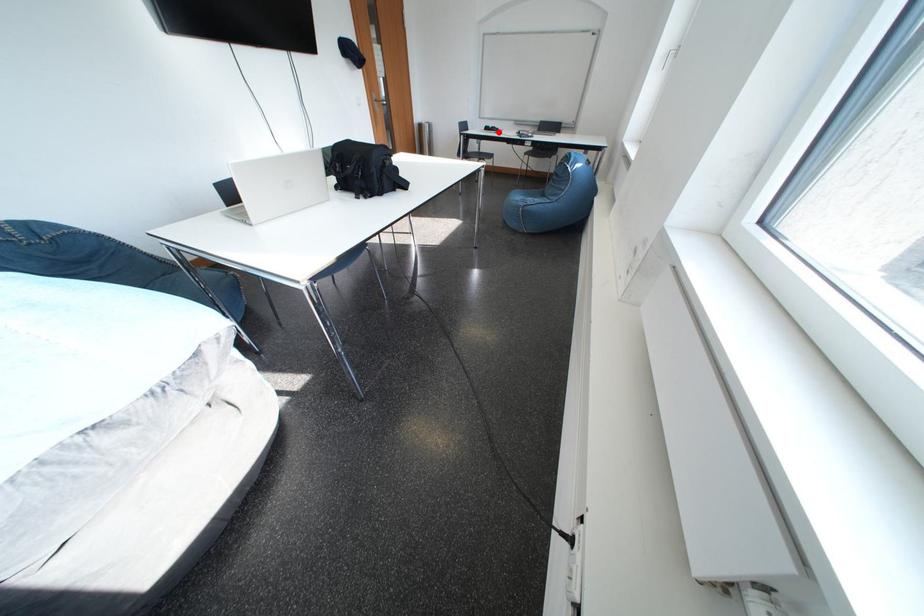
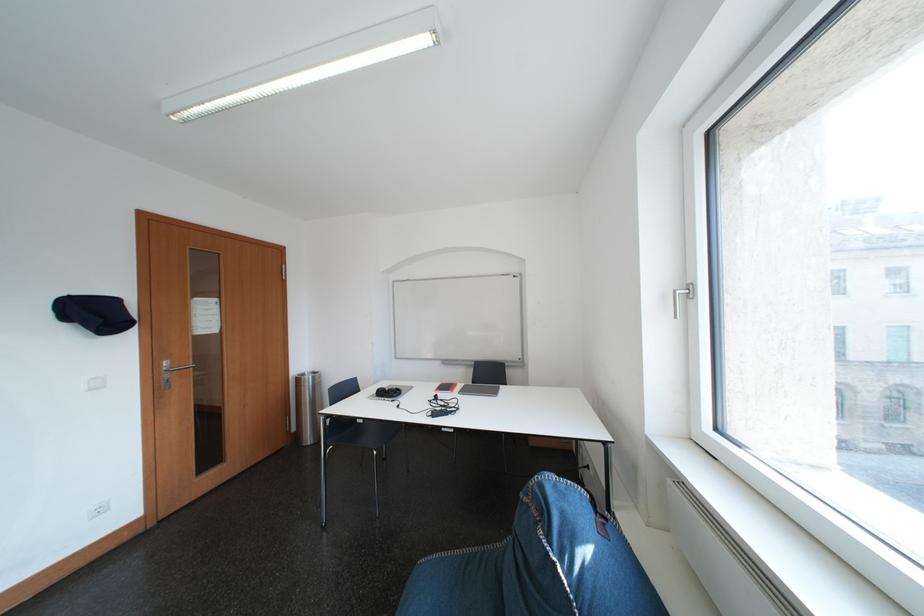
Question: A red point is marked in image1. In image2, is the corresponding 3D point closer to the camera or farther? Reply with the corresponding letter.

Choices:
 (A) The corresponding 3D point is closer.
 (B) The corresponding 3D point is farther.

Answer: (B)